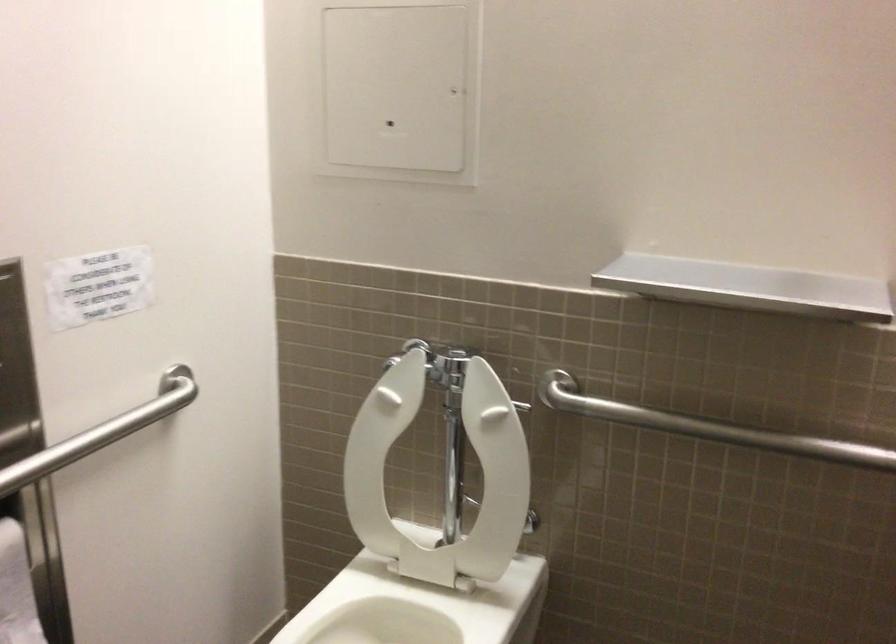
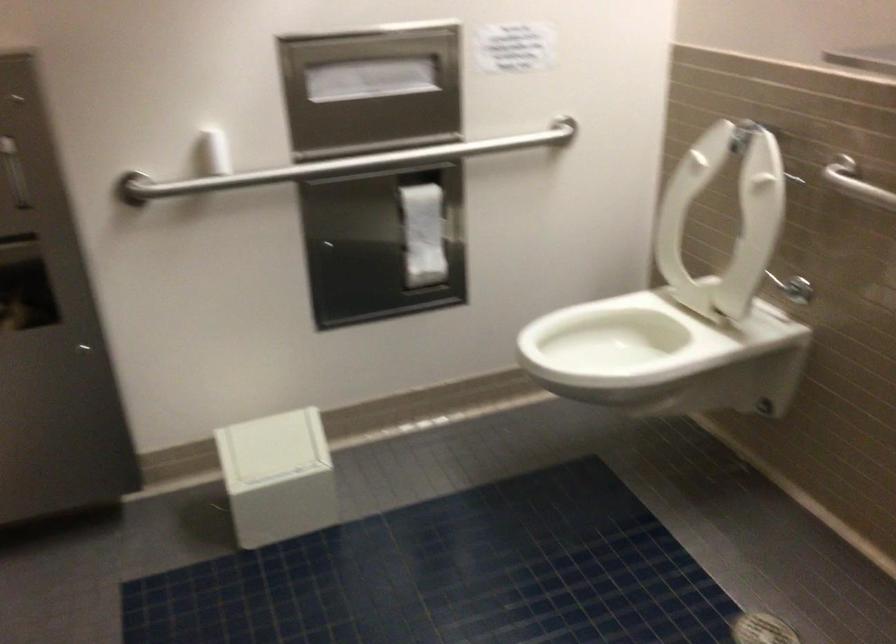
In the second image, find the point that corresponds to pixel 614 409 in the first image.

(856, 183)